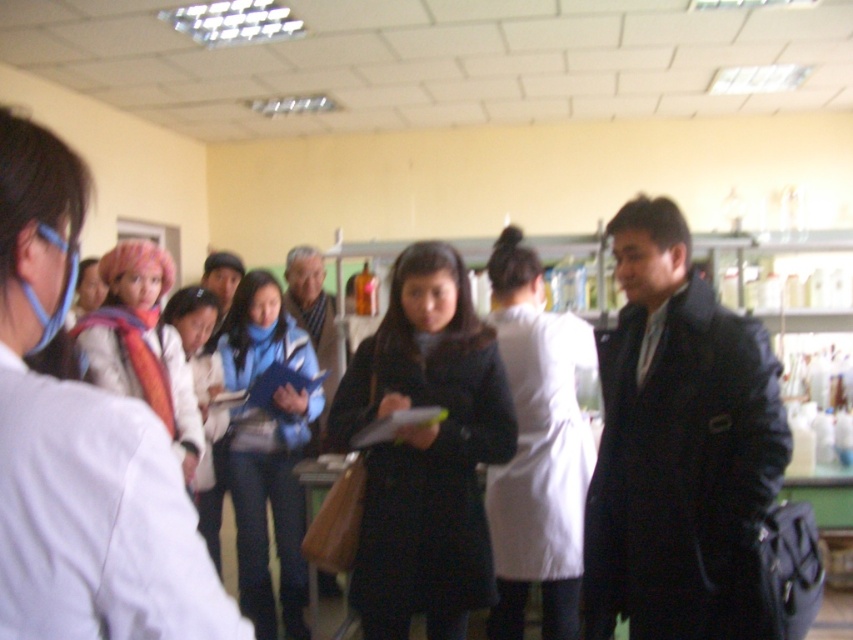
Question: Estimate the real-world distances between objects in this image. Which object is closer to the blue fleece jacket at center?

Choices:
 (A) white lab coat at center
 (B) matte pink scarf at center
 (C) black matte lab coat at center
 (D) black matte coat at center

Answer: (B)

Question: Does black matte lab coat at center lie in front of black matte coat at center?

Choices:
 (A) no
 (B) yes

Answer: (B)

Question: Estimate the real-world distances between objects in this image. Which object is closer to the blue fleece jacket at center?

Choices:
 (A) black matte lab coat at center
 (B) black matte coat at center
 (C) matte pink scarf at center
 (D) white lab coat at center

Answer: (C)

Question: Is black matte coat at center above matte pink scarf at center?

Choices:
 (A) no
 (B) yes

Answer: (A)

Question: Among these points, which one is farthest from the camera?

Choices:
 (A) (671, 397)
 (B) (546, 554)

Answer: (B)

Question: Does black matte coat at center appear under blue fleece jacket at center?

Choices:
 (A) yes
 (B) no

Answer: (B)